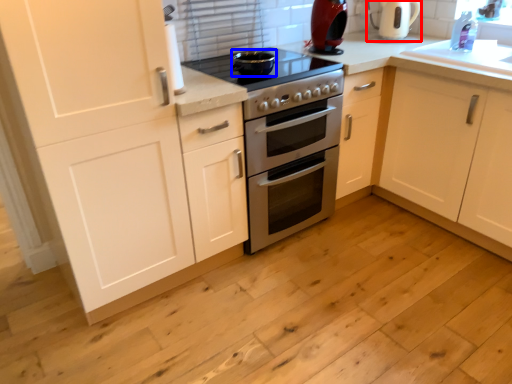
Question: Which object is closer to the camera taking this photo, coffeepot (highlighted by a red box) or appliance (highlighted by a blue box)?

Choices:
 (A) coffeepot
 (B) appliance

Answer: (B)